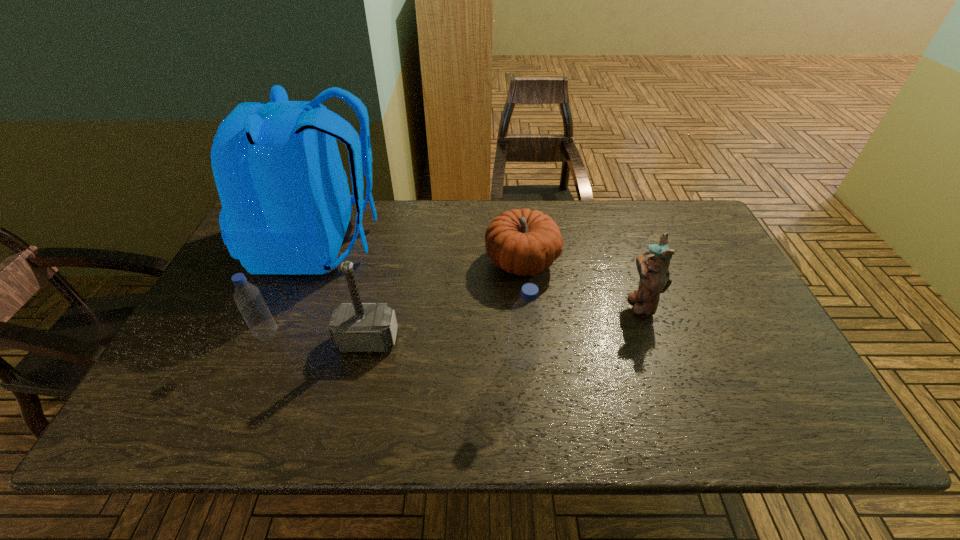
The image size is (960, 540). I want to click on free spot located 0.050m on the back of the tallest object, so pyautogui.click(x=400, y=244).

Find the location of a particular element. This screenshot has width=960, height=540. vacant space situated on the front-facing side of the figurine is located at coordinates (541, 304).

At what (x,y) coordinates should I click in order to perform the action: click on free location located 0.060m on the front-facing side of the figurine. Please return your answer as a coordinate pair (x, y). The height and width of the screenshot is (540, 960). Looking at the image, I should click on (605, 304).

Locate an element on the screen. free point located 0.160m on the front-facing side of the figurine is located at coordinates (567, 304).

Where is `vacant space located 0.100m on the back of the shortest object`? vacant space located 0.100m on the back of the shortest object is located at coordinates (517, 219).

The width and height of the screenshot is (960, 540). I want to click on blank area located 0.090m for striking with the head of the hammer, so click(x=357, y=388).

At what (x,y) coordinates should I click in order to perform the action: click on backpack at the far edge. Please return your answer as a coordinate pair (x, y). The image size is (960, 540). Looking at the image, I should click on (286, 205).

Locate an element on the screen. pumpkin present at the far edge is located at coordinates (523, 242).

Where is `object situated at the near edge`? object situated at the near edge is located at coordinates (523, 350).

You are a GUI agent. You are given a task and a screenshot of the screen. Output one action in this format:
    pyautogui.click(x=<x>, y=<y>)
    Task: Click on the bottle that is at the left edge
    
    Given the screenshot: What is the action you would take?
    pyautogui.click(x=247, y=296)